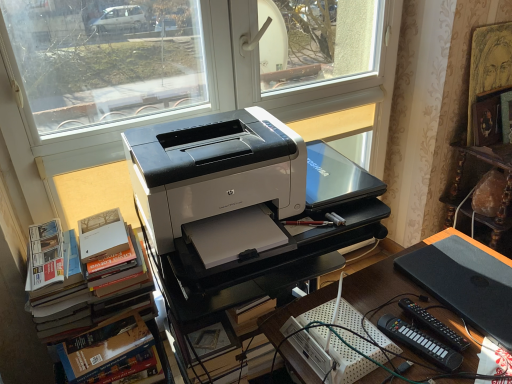
The width and height of the screenshot is (512, 384). What do you see at coordinates (476, 182) in the screenshot?
I see `wooden bookshelf at right` at bounding box center [476, 182].

Locate an element on the screen. The width and height of the screenshot is (512, 384). wooden bookshelf at right is located at coordinates (476, 182).

Measure the distance between black plastic desk at center and camera.

black plastic desk at center is 34.79 inches from camera.

This screenshot has width=512, height=384. What do you see at coordinates (420, 343) in the screenshot?
I see `black plastic remote control at lower right, acting as the 1th equipment starting from the left` at bounding box center [420, 343].

The height and width of the screenshot is (384, 512). In order to click on white plastic printer at center in this screenshot , I will do `click(213, 170)`.

Where is `hardcover books at left`? The width and height of the screenshot is (512, 384). hardcover books at left is located at coordinates (96, 304).

How different are the orientations of black plastic desk at center and black matte laptop at lower right in degrees?

The facing directions of black plastic desk at center and black matte laptop at lower right are 0.25 degrees apart.

Is black plastic desk at center shorter than black matte laptop at lower right?

In fact, black plastic desk at center may be taller than black matte laptop at lower right.

Is black matte laptop at lower right located within black plastic desk at center?

No.

From the picture: From a real-world perspective, does black plastic desk at center stand above black matte laptop at lower right?

Actually, black plastic desk at center is physically below black matte laptop at lower right in the real world.

Is hardcover books at left surrounding wooden bookshelf at right?

Actually, wooden bookshelf at right is outside hardcover books at left.

From the image's perspective, which one is positioned higher, hardcover books at left or wooden bookshelf at right?

wooden bookshelf at right appears higher in the image.

Considering the positions of objects hardcover books at left and wooden bookshelf at right in the image provided, who is in front, hardcover books at left or wooden bookshelf at right?

hardcover books at left is in front.

From a real-world perspective, which object rests below the other?

wooden bookshelf at right.

From the image's perspective, is wooden bookshelf at right located above or below black plastic remote control at lower right, acting as the 1th equipment starting from the left?

wooden bookshelf at right is situated higher than black plastic remote control at lower right, acting as the 1th equipment starting from the left, in the image.

Which object is positioned more to the left, wooden bookshelf at right or black plastic remote control at lower right, acting as the 1th equipment starting from the left?

From the viewer's perspective, black plastic remote control at lower right, acting as the 1th equipment starting from the left, appears more on the left side.

From a real-world perspective, is wooden bookshelf at right on black plastic remote control at lower right, acting as the 1th equipment starting from the left?

Incorrect, from a real-world perspective, wooden bookshelf at right is lower than black plastic remote control at lower right, acting as the 1th equipment starting from the left.

Is wooden bookshelf at right taller than black plastic remote control at lower right, positioned as the second equipment in right-to-left order?

Indeed, wooden bookshelf at right has a greater height compared to black plastic remote control at lower right, positioned as the second equipment in right-to-left order.

Which is more to the left, black matte laptop at lower right or black plastic remote control at lower right, which is the 1th equipment in right-to-left order?

From the viewer's perspective, black plastic remote control at lower right, which is the 1th equipment in right-to-left order, appears more on the left side.

Which of these two, black matte laptop at lower right or black plastic remote control at lower right, which is the 1th equipment in right-to-left order, is bigger?

With larger size is black matte laptop at lower right.

From the image's perspective, does black matte laptop at lower right appear lower than black plastic remote control at lower right, which is the 1th equipment in right-to-left order?

No, from the image's perspective, black matte laptop at lower right is not beneath black plastic remote control at lower right, which is the 1th equipment in right-to-left order.

Could you tell me if wooden bookshelf at right is facing black plastic remote control at lower right, which is the 1th equipment in right-to-left order?

No.

How many degrees apart are the facing directions of wooden bookshelf at right and black plastic remote control at lower right, which ranks as the 2th equipment in left-to-right order?

They differ by 6.98 degrees in their facing directions.

Considering the relative sizes of wooden bookshelf at right and black plastic remote control at lower right, which is the 1th equipment in right-to-left order, in the image provided, is wooden bookshelf at right taller than black plastic remote control at lower right, which is the 1th equipment in right-to-left order,?

Indeed, wooden bookshelf at right has a greater height compared to black plastic remote control at lower right, which is the 1th equipment in right-to-left order.

Considering the positions of point (487, 226) and point (426, 327), is point (487, 226) closer or farther from the camera than point (426, 327)?

Point (487, 226) is farther from the camera than point (426, 327).

From the picture: From the image's perspective, is black plastic desk at center under white glossy printer at center?

Correct, black plastic desk at center appears lower than white glossy printer at center in the image.

Which is correct: black plastic desk at center is inside white glossy printer at center, or outside of it?

black plastic desk at center is not inside white glossy printer at center, it's outside.

Is point (380, 286) closer to viewer compared to point (251, 292)?

Yes, point (380, 286) is closer to viewer.

In terms of height, does black plastic desk at center look taller or shorter compared to white glossy printer at center?

In the image, black plastic desk at center appears to be shorter than white glossy printer at center.

Is point (317, 381) closer to camera compared to point (143, 344)?

That is True.

Is black plastic desk at center at the left side of hardcover books at left?

In fact, black plastic desk at center is to the right of hardcover books at left.

Which object is more forward, black plastic desk at center or hardcover books at left?

Positioned in front is black plastic desk at center.

Where is `computer that appears above the black plastic desk at center (from a real-world perspective)`? This screenshot has width=512, height=384. computer that appears above the black plastic desk at center (from a real-world perspective) is located at coordinates (465, 284).

Locate an element on the screen. The width and height of the screenshot is (512, 384). bookcase that appears below the wooden bookshelf at right (from the image's perspective) is located at coordinates (96, 304).

From the image, which object appears to be nearer to hardcover books at left, white glossy printer at center or black matte laptop at lower right?

white glossy printer at center is positioned closer to the anchor hardcover books at left.

Estimate the real-world distances between objects in this image. Which object is further from black plastic desk at center, white plastic printer at center or black matte laptop at lower right?

Among the two, white plastic printer at center is located further to black plastic desk at center.

Considering their positions, is black plastic desk at center positioned further to hardcover books at left than black matte laptop at lower right?

Based on the image, black matte laptop at lower right appears to be further to hardcover books at left.

From the image, which object appears to be farther from wooden bookshelf at right, black plastic remote control at lower right, positioned as the second equipment in right-to-left order, or black matte laptop at lower right?

black plastic remote control at lower right, positioned as the second equipment in right-to-left order, is further to wooden bookshelf at right.

Based on their spatial positions, is black matte laptop at lower right or black plastic remote control at lower right, positioned as the second equipment in right-to-left order, closer to white plastic printer at center?

Based on the image, black matte laptop at lower right appears to be nearer to white plastic printer at center.

Based on the photo, which object lies nearer to the anchor point black plastic remote control at lower right, which is the 1th equipment in right-to-left order, black matte laptop at lower right or wooden bookshelf at right?

black matte laptop at lower right lies closer to black plastic remote control at lower right, which is the 1th equipment in right-to-left order, than the other object.

Which object lies nearer to the anchor point black plastic remote control at lower right, positioned as the second equipment in right-to-left order, black plastic remote control at lower right, which is the 1th equipment in right-to-left order, or black matte laptop at lower right?

Based on the image, black plastic remote control at lower right, which is the 1th equipment in right-to-left order, appears to be nearer to black plastic remote control at lower right, positioned as the second equipment in right-to-left order.

Estimate the real-world distances between objects in this image. Which object is closer to black matte laptop at lower right, black plastic desk at center or white glossy printer at center?

black plastic desk at center is closer to black matte laptop at lower right.

This screenshot has width=512, height=384. Identify the location of desk between white glossy printer at center and black matte laptop at lower right from left to right. (374, 285).

You are a GUI agent. You are given a task and a screenshot of the screen. Output one action in this format:
    pyautogui.click(x=<x>, y=<y>)
    Task: Click on the printer situated between hardcover books at left and black plastic remote control at lower right, which ranks as the 2th equipment in left-to-right order, from left to right
    This screenshot has width=512, height=384.
    Given the screenshot: What is the action you would take?
    pyautogui.click(x=213, y=170)

At what (x,y) coordinates should I click in order to perform the action: click on computer desk between hardcover books at left and black plastic remote control at lower right, acting as the 1th equipment starting from the left, from left to right. Please return your answer as a coordinate pair (x, y). This screenshot has height=384, width=512. Looking at the image, I should click on (263, 268).

This screenshot has width=512, height=384. Find the location of `printer located between hardcover books at left and white glossy printer at center in the left-right direction`. printer located between hardcover books at left and white glossy printer at center in the left-right direction is located at coordinates (213, 170).